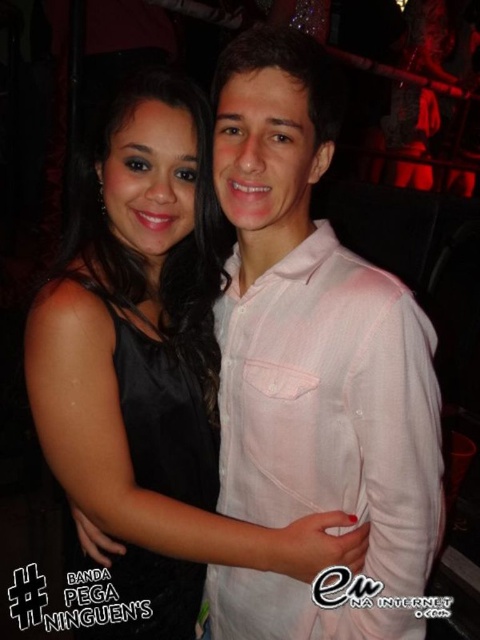
You are at a party and see two people interacting. The person wearing the black satin dress at left is standing to your left. Where is the pink cotton shirt at center located relative to you?

The pink cotton shirt at center is positioned on the right side of the black satin dress at left. Since the black satin dress at left is to your left, the pink cotton shirt at center would be further to your right.

You are organizing a costume party and need to ensure that all outfits fit through a narrow doorway. The doorway has a width of 1.2 meters. You have two outfits to check for clearance. The first is the black satin dress at center, and the second is the pink cotton shirt at center. Based on their sizes, which outfit is more likely to require assistance to maneuver through the doorway?

The black satin dress at center is bigger than the pink cotton shirt at center, so it is more likely to require assistance to maneuver through the doorway due to its larger size.